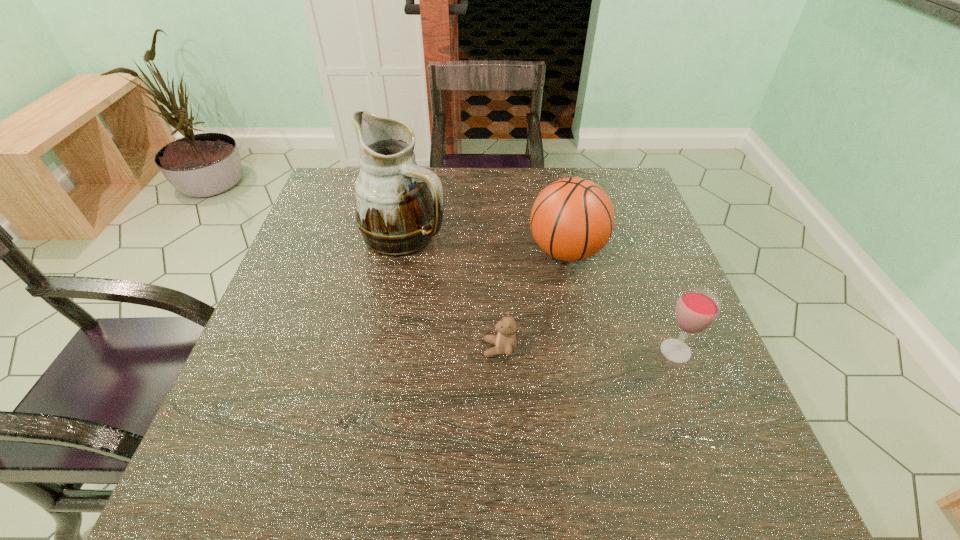
Locate an element on the screen. This screenshot has width=960, height=540. the leftmost object is located at coordinates (399, 206).

Locate an element on the screen. pitcher is located at coordinates click(399, 206).

Image resolution: width=960 pixels, height=540 pixels. Identify the location of the third object from left to right. (572, 219).

The width and height of the screenshot is (960, 540). I want to click on basketball, so click(x=572, y=219).

Locate an element on the screen. The image size is (960, 540). the rightmost object is located at coordinates (696, 310).

The width and height of the screenshot is (960, 540). Identify the location of wineglass. (696, 310).

The height and width of the screenshot is (540, 960). Identify the location of teddy bear. (505, 341).

Locate an element on the screen. This screenshot has height=540, width=960. the second object from left to right is located at coordinates (505, 341).

Locate an element on the screen. The height and width of the screenshot is (540, 960). vacant region located 0.400m from the spout of the tallest object is located at coordinates (602, 235).

Where is `vacant region located on the back of the basketball`? vacant region located on the back of the basketball is located at coordinates (551, 180).